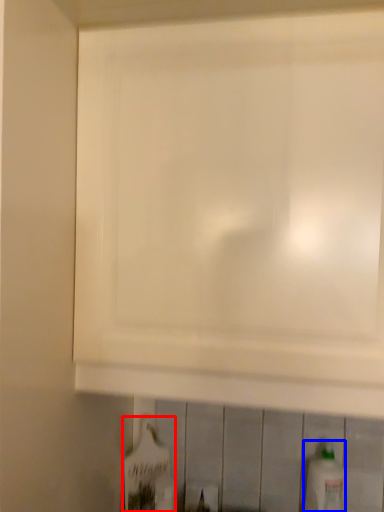
Question: Which object appears closest to the camera in this image, bottle (highlighted by a red box) or bottle (highlighted by a blue box)?

Choices:
 (A) bottle
 (B) bottle

Answer: (B)